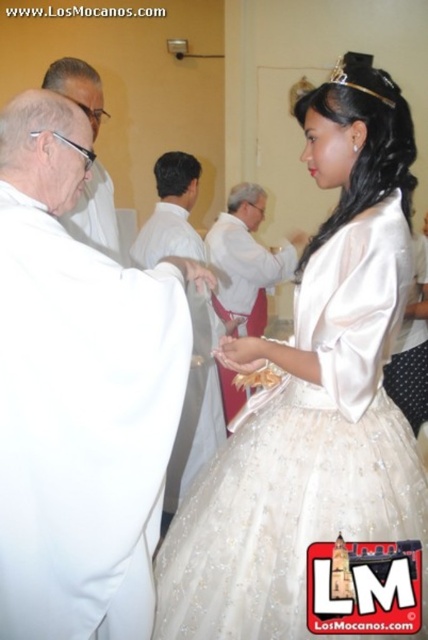
Question: Can you confirm if ivory satin dress at center is positioned above matte white robe at left?

Choices:
 (A) no
 (B) yes

Answer: (A)

Question: Which of the following is the farthest from the observer?

Choices:
 (A) (83, 76)
 (B) (226, 497)

Answer: (A)

Question: Which is farther from the white satin robe at left?

Choices:
 (A) white satin shirt at center
 (B) ivory satin dress at center

Answer: (A)

Question: Which object is positioned closest to the white satin shirt at center?

Choices:
 (A) matte white robe at left
 (B) white satin robe at center
 (C) white satin robe at left
 (D) gold metallic tiara at upper center

Answer: (B)

Question: Does white satin robe at center have a greater width compared to gold metallic tiara at upper center?

Choices:
 (A) no
 (B) yes

Answer: (B)

Question: Is white satin robe at left positioned behind ivory satin dress at center?

Choices:
 (A) no
 (B) yes

Answer: (A)